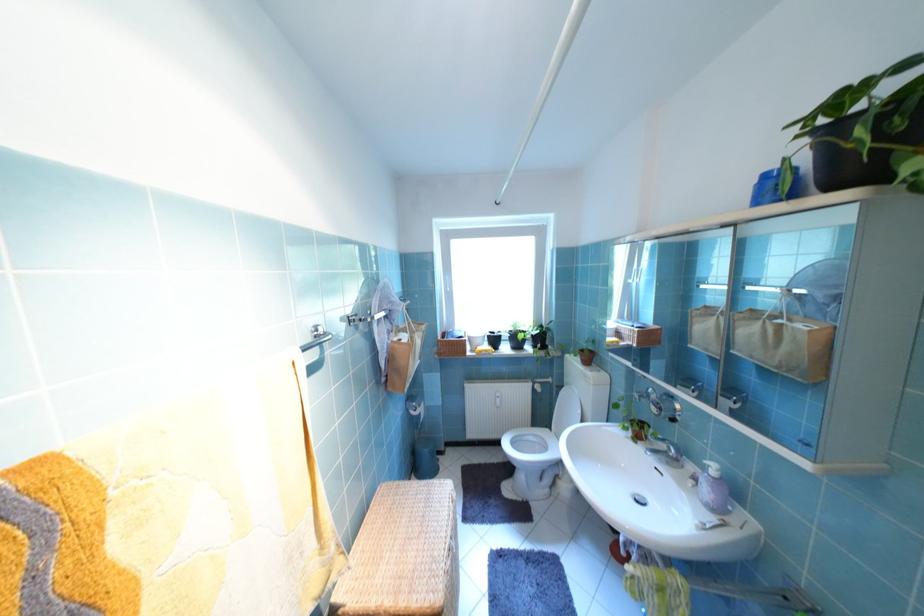
This screenshot has width=924, height=616. What do you see at coordinates (711, 469) in the screenshot?
I see `the soap dispenser pump` at bounding box center [711, 469].